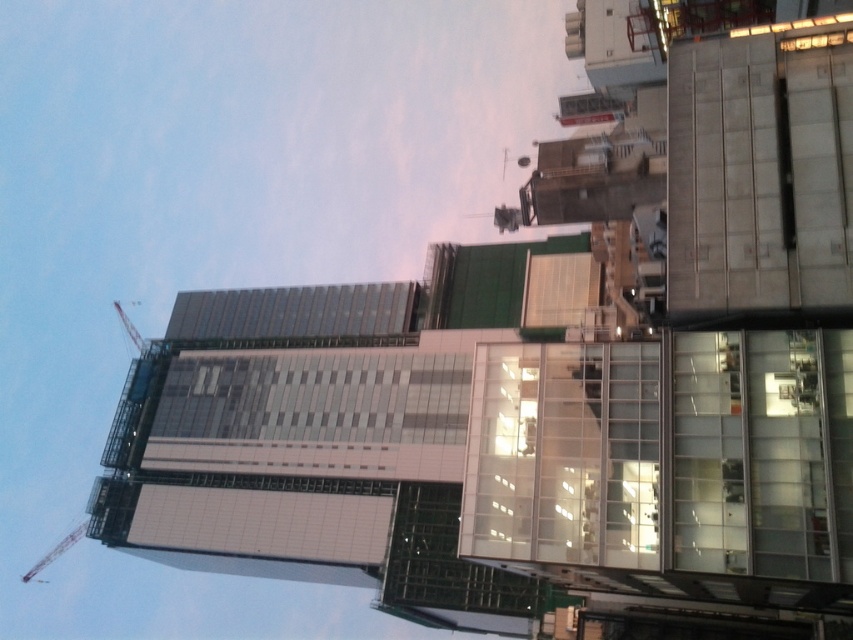
Does point (49, 560) come behind point (114, 301)?

Yes, it is behind point (114, 301).

Consider the image. Can you confirm if metallic red crane at left is taller than metallic construction crane at upper left?

Indeed, metallic red crane at left has a greater height compared to metallic construction crane at upper left.

Is point (74, 531) less distant than point (140, 346)?

No.

The image size is (853, 640). In order to click on metallic red crane at left in this screenshot , I will do `click(56, 550)`.